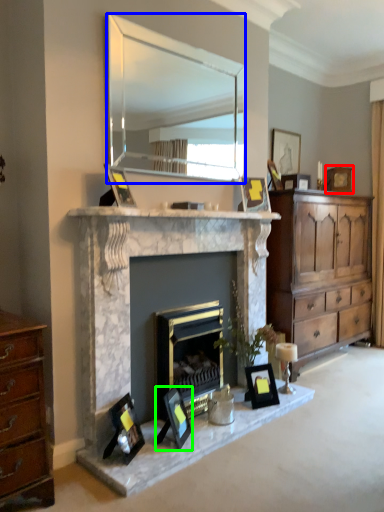
Question: Which is farther away from picture frame (highlighted by a red box)? mirror (highlighted by a blue box) or picture frame (highlighted by a green box)?

Choices:
 (A) mirror
 (B) picture frame

Answer: (A)